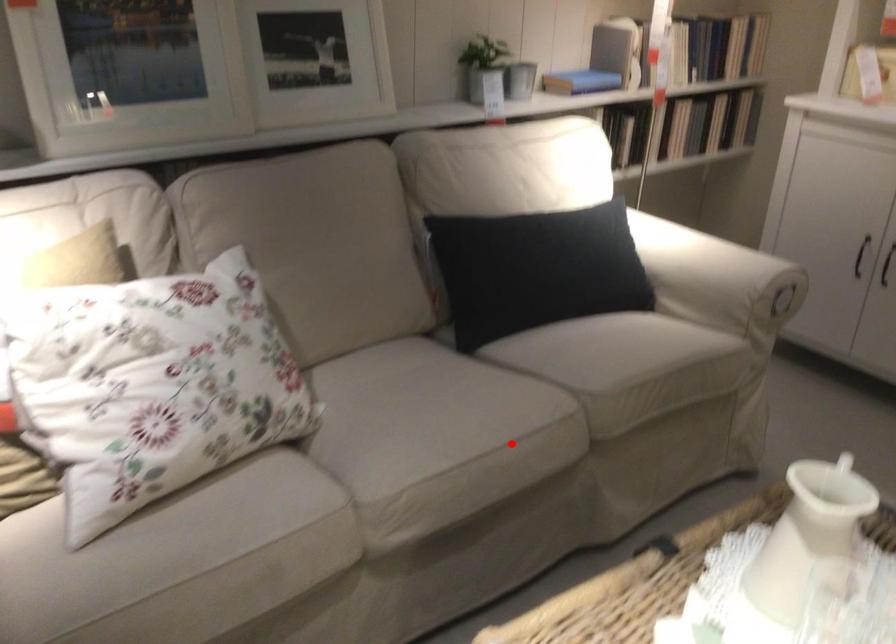
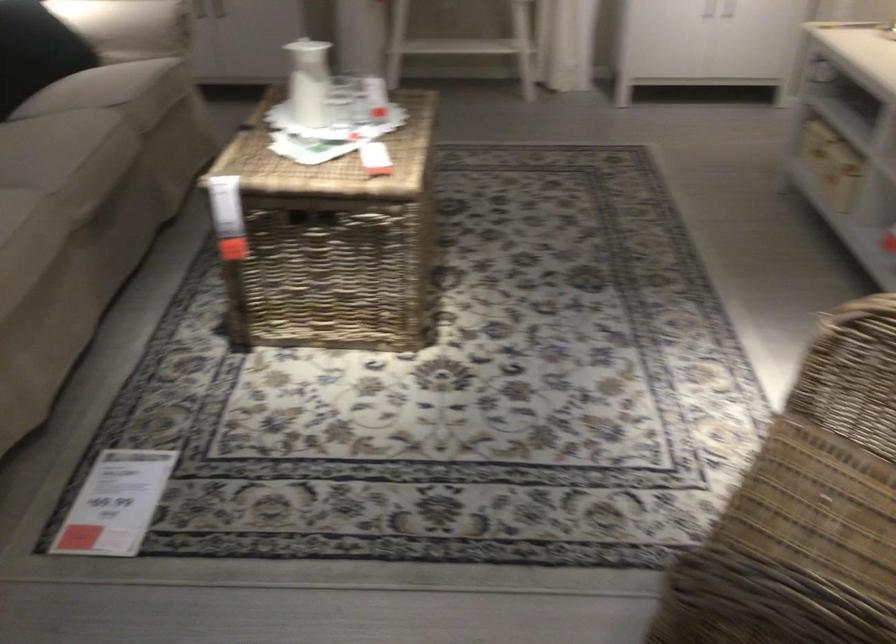
Question: I am providing you with two images of the same scene from different viewpoints. In image1, a red point is highlighted. Considering the same 3D point in image2, which of the following is correct?

Choices:
 (A) It is closer
 (B) It is farther

Answer: (B)